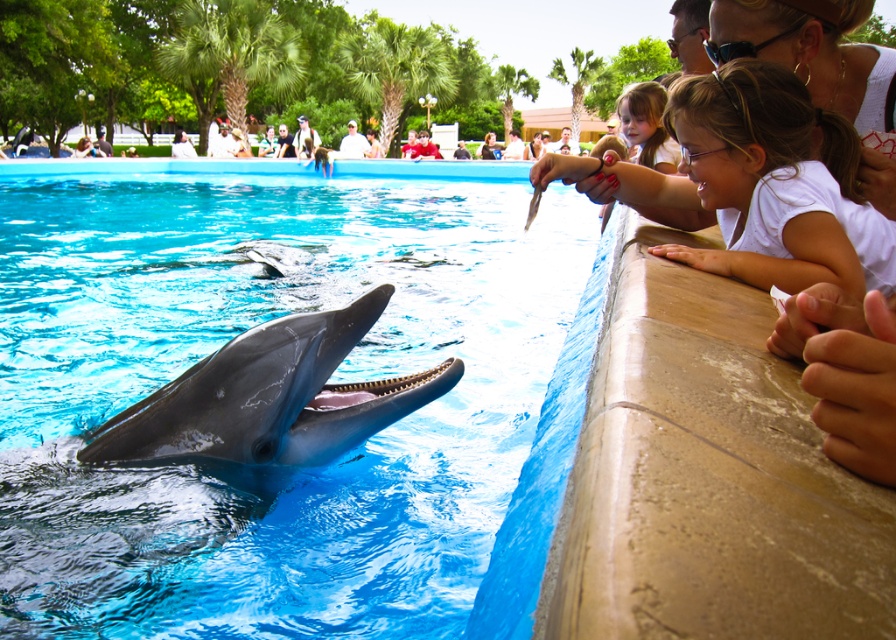
The height and width of the screenshot is (640, 896). I want to click on blue smooth water at center, so click(x=329, y=380).

Is blue smooth water at center above white matte hair at upper right?

Yes, blue smooth water at center is above white matte hair at upper right.

The height and width of the screenshot is (640, 896). Describe the element at coordinates (329, 380) in the screenshot. I see `blue smooth water at center` at that location.

Where is `blue smooth water at center`? blue smooth water at center is located at coordinates (329, 380).

Does white matte shirt at upper right appear on the left side of smooth gray dolphin at center?

Incorrect, white matte shirt at upper right is not on the left side of smooth gray dolphin at center.

Who is positioned more to the right, white matte shirt at upper right or smooth gray dolphin at center?

From the viewer's perspective, white matte shirt at upper right appears more on the right side.

Which is in front, point (824, 268) or point (194, 364)?

Positioned in front is point (824, 268).

Identify the location of white matte shirt at upper right. Image resolution: width=896 pixels, height=640 pixels. (772, 180).

Who is more distant from viewer, (412, 404) or (790, 49)?

The point (790, 49) is behind.

Which is in front, point (281, 355) or point (881, 58)?

Positioned in front is point (281, 355).

Identify the location of smooth gray dolphin at center. The image size is (896, 640). (269, 397).